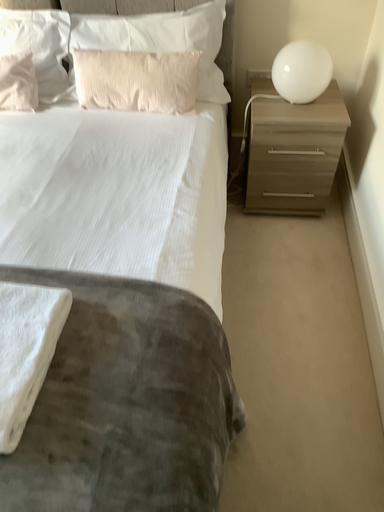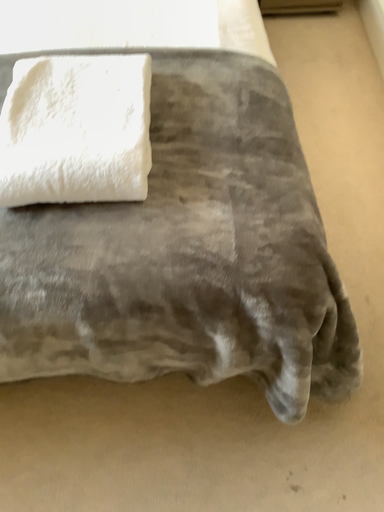
Question: Which way did the camera rotate in the video?

Choices:
 (A) rotated left
 (B) rotated right

Answer: (B)